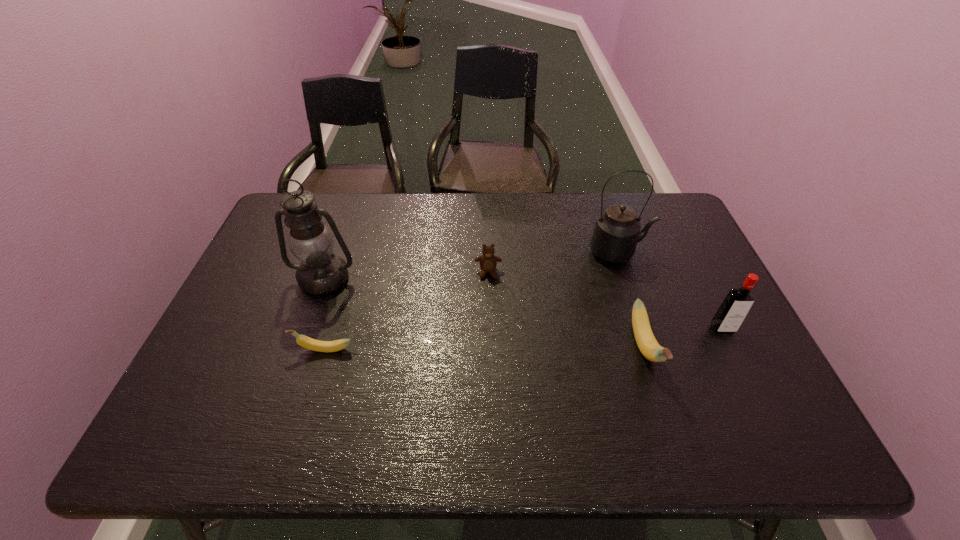
The width and height of the screenshot is (960, 540). I want to click on vacant space that is in between the fourth object from right to left and the right banana, so click(x=566, y=309).

You are a GUI agent. You are given a task and a screenshot of the screen. Output one action in this format:
    pyautogui.click(x=<x>, y=<y>)
    Task: Click on the vacant region between the fifth tallest object and the oil lamp
    Image resolution: width=960 pixels, height=540 pixels.
    Given the screenshot: What is the action you would take?
    pyautogui.click(x=406, y=275)

Image resolution: width=960 pixels, height=540 pixels. I want to click on empty location between the teddy bear and the third tallest object, so click(605, 300).

In order to click on free space between the teddy bear and the oil lamp in this screenshot , I will do `click(406, 275)`.

At what (x,y) coordinates should I click in order to perform the action: click on vacant space that's between the taller banana and the second tallest object. Please return your answer as a coordinate pair (x, y). Looking at the image, I should click on (632, 299).

Image resolution: width=960 pixels, height=540 pixels. I want to click on free space between the second shortest object and the taller banana, so click(566, 309).

What are the coordinates of `vacant space in between the second shortest object and the shortest object` in the screenshot? It's located at (406, 310).

Identify which object is the fourth nearest to the fourth object from right to left. Please provide its 2D coordinates. Your answer should be formatted as a tuple, i.e. [(x, y)], where the tuple contains the x and y coordinates of a point satisfying the conditions above.

[(304, 341)]

Locate which object is the fourth closest to the fifth shortest object. Please provide its 2D coordinates. Your answer should be formatted as a tuple, i.e. [(x, y)], where the tuple contains the x and y coordinates of a point satisfying the conditions above.

[(321, 272)]

I want to click on vacant space that satisfies the following two spatial constraints: 1. at the stem of the taller banana; 2. at the stem of the left banana, so click(x=645, y=349).